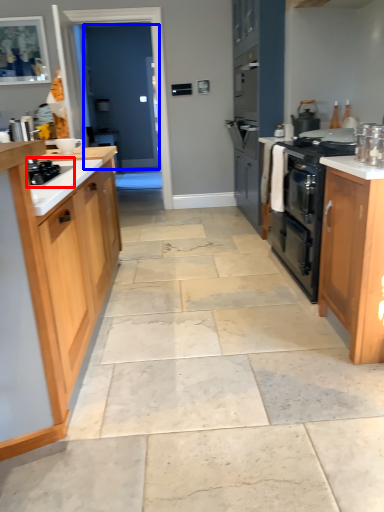
Question: Which object is closer to the camera taking this photo, gas stove (highlighted by a red box) or glass door (highlighted by a blue box)?

Choices:
 (A) gas stove
 (B) glass door

Answer: (A)